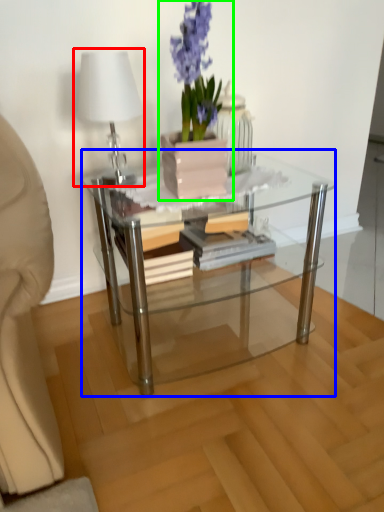
Question: Estimate the real-world distances between objects in this image. Which object is closer to table lamp (highlighted by a red box), coffee table (highlighted by a blue box) or houseplant (highlighted by a green box)?

Choices:
 (A) coffee table
 (B) houseplant

Answer: (B)